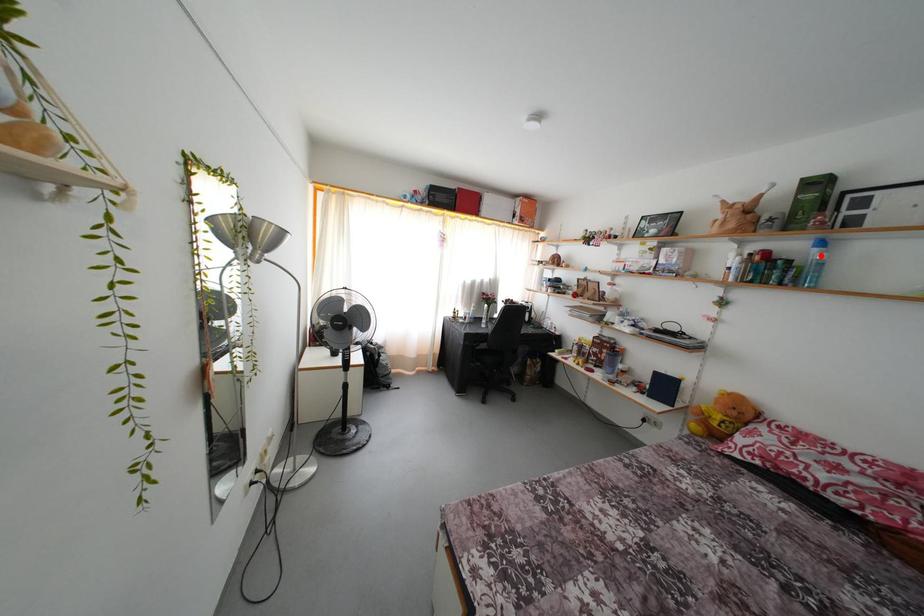
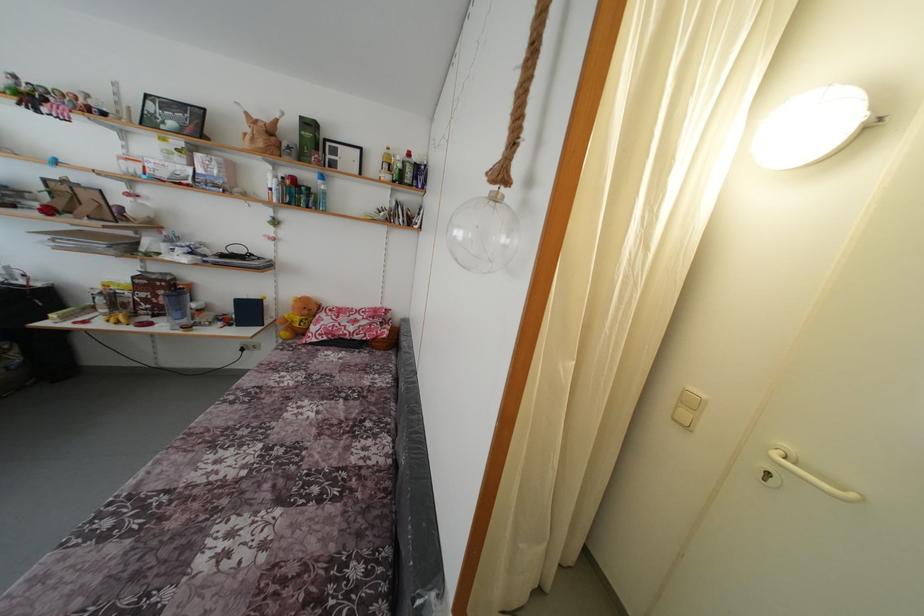
In the second image, find the point that corresponds to the highlighted location in the first image.

(324, 188)